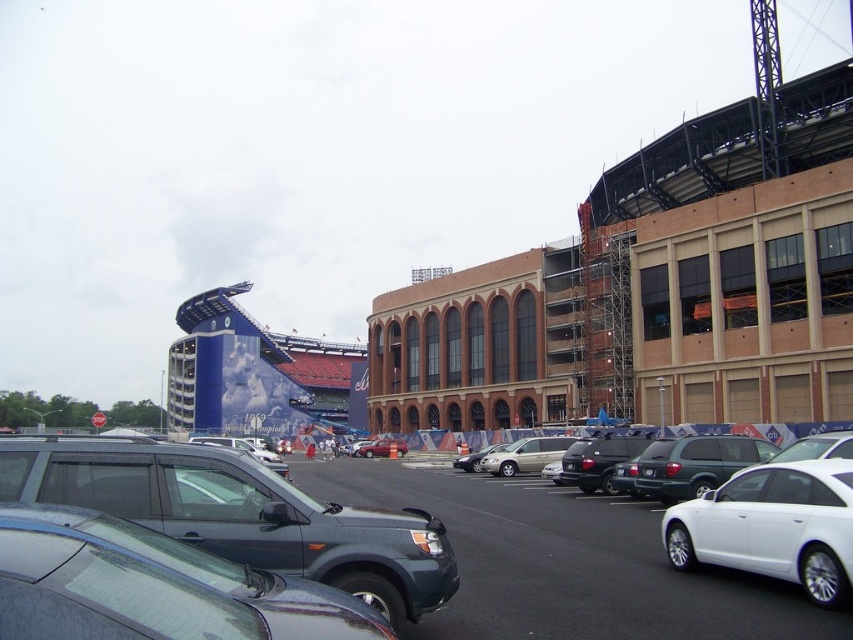
Question: Considering the real-world distances, which object is closest to the shiny black sedan at center?

Choices:
 (A) satin silver sedan at center
 (B) green matte suv at center
 (C) matte black suv at center
 (D) matte gray suv at center

Answer: (B)

Question: Which point is farther from the camera taking this photo?

Choices:
 (A) (636, 451)
 (B) (712, 483)

Answer: (A)

Question: Is metallic silver minivan at center positioned at the back of matte black suv at center?

Choices:
 (A) no
 (B) yes

Answer: (A)

Question: Which point is farther to the camera?

Choices:
 (A) shiny black sedan at center
 (B) satin silver sedan at center
 (C) metallic silver minivan at center
 (D) matte gray suv at center

Answer: (B)

Question: From the image, what is the correct spatial relationship of matte gray suv at center in relation to satin silver sedan at center?

Choices:
 (A) right
 (B) left

Answer: (B)

Question: Is white glossy sedan at center to the right of green matte suv at center from the viewer's perspective?

Choices:
 (A) yes
 (B) no

Answer: (B)